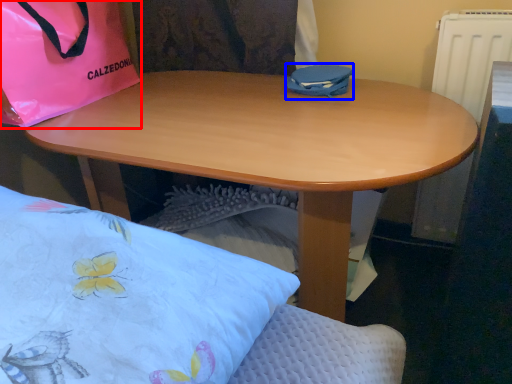
Question: Which object appears closest to the camera in this image, handbag (highlighted by a red box) or bag (highlighted by a blue box)?

Choices:
 (A) handbag
 (B) bag

Answer: (A)